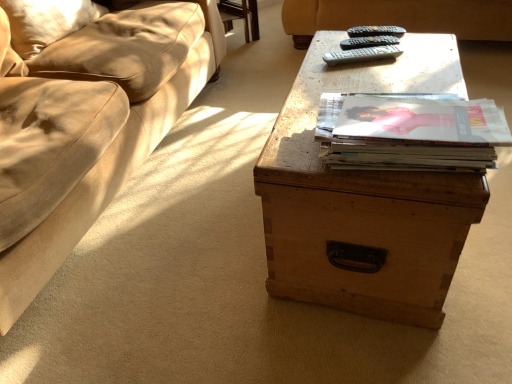
Find the location of a particular element. The image size is (512, 384). blank space to the left of wooden trunk at center is located at coordinates (180, 235).